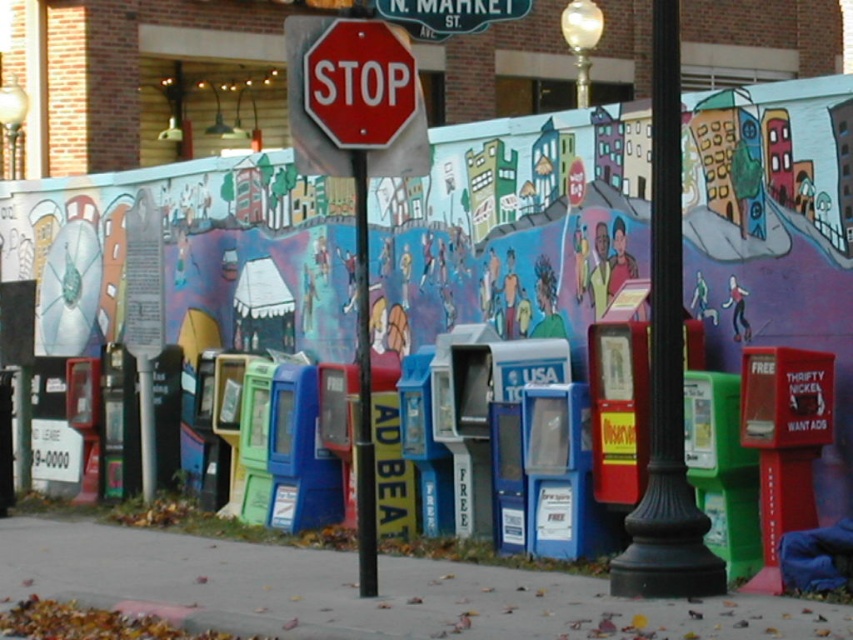
Question: Is the position of gray concrete sidewalk at center more distant than that of red stop sign at upper center?

Choices:
 (A) yes
 (B) no

Answer: (A)

Question: Can you confirm if gray concrete sidewalk at center is bigger than red stop sign at upper center?

Choices:
 (A) yes
 (B) no

Answer: (B)

Question: Estimate the real-world distances between objects in this image. Which object is farther from the red matte stop sign at center?

Choices:
 (A) black metal pole at center
 (B) red stop sign at upper center
 (C) gray concrete sidewalk at center

Answer: (C)

Question: Can you confirm if gray concrete sidewalk at center is smaller than black metal pole at center?

Choices:
 (A) no
 (B) yes

Answer: (B)

Question: Which point is closer to the camera taking this photo?

Choices:
 (A) (369, 58)
 (B) (437, 12)
 (C) (697, 636)

Answer: (C)

Question: Among these points, which one is nearest to the camera?

Choices:
 (A) (660, 122)
 (B) (357, 429)

Answer: (A)